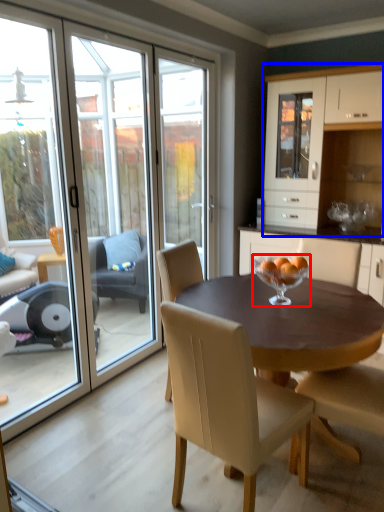
Question: Among these objects, which one is nearest to the camera, glass bowl (highlighted by a red box) or cabinetry (highlighted by a blue box)?

Choices:
 (A) glass bowl
 (B) cabinetry

Answer: (A)